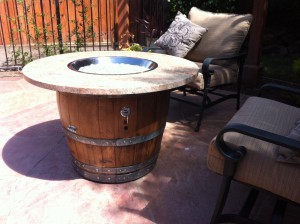
The width and height of the screenshot is (300, 224). What are the coordinates of `the front left leg of the chair` in the screenshot? It's located at (220, 202), (201, 116).